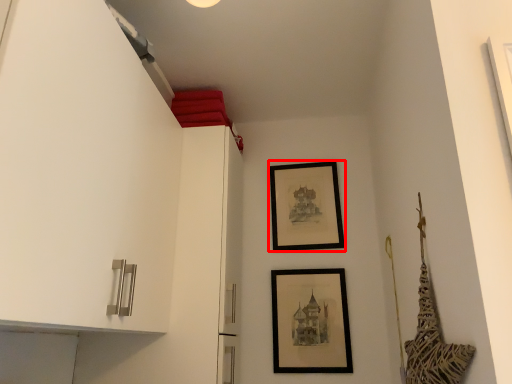
Question: From the image, what is the correct spatial relationship of picture frame (annotated by the red box) in relation to picture frame?

Choices:
 (A) right
 (B) left

Answer: (A)